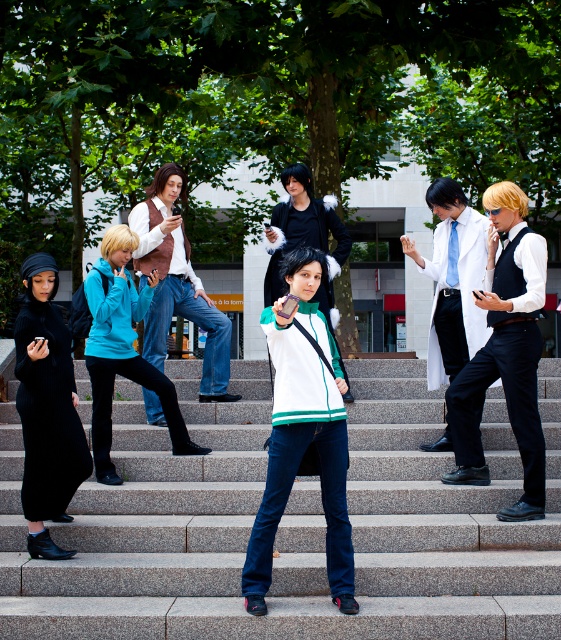
Question: Which object appears farthest from the camera in this image?

Choices:
 (A) white matte jacket at center
 (B) teal fabric jacket at center
 (C) denim pants at center

Answer: (C)

Question: Where is denim pants at center located in relation to matte black wig at center in the image?

Choices:
 (A) below
 (B) above

Answer: (A)

Question: Which object is farther from the camera taking this photo?

Choices:
 (A) denim pants at center
 (B) teal fabric jacket at center
 (C) matte black wig at center
 (D) white lab coat at center

Answer: (A)

Question: From the image, what is the correct spatial relationship of matte white vest at center in relation to matte black wig at center?

Choices:
 (A) left
 (B) right

Answer: (B)

Question: From the image, what is the correct spatial relationship of ribbed black dress at lower left in relation to white lab coat at center?

Choices:
 (A) left
 (B) right

Answer: (A)

Question: Which point is farther to the camera?

Choices:
 (A) (457, 330)
 (B) (53, 429)
 (C) (343, 413)
 (D) (210, 352)

Answer: (D)